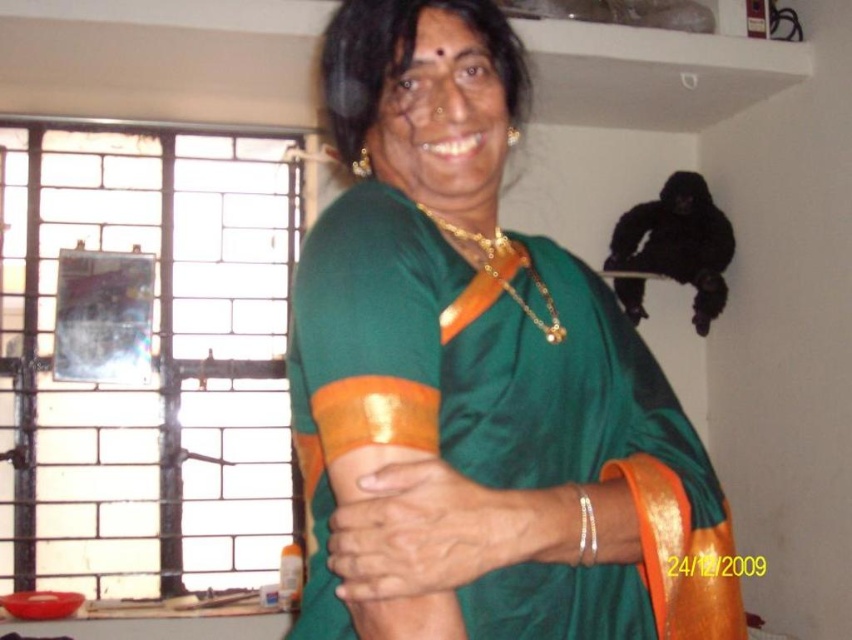
Question: Is green silk hand at center in front of gold chain at upper center?

Choices:
 (A) no
 (B) yes

Answer: (B)

Question: Which of the following is the closest to the observer?

Choices:
 (A) gold chain at upper center
 (B) green silk hand at center

Answer: (B)

Question: Does green silk saree at center come behind gold chain at upper center?

Choices:
 (A) yes
 (B) no

Answer: (B)

Question: Is green silk hand at center below gold chain at upper center?

Choices:
 (A) yes
 (B) no

Answer: (A)

Question: Which object is positioned farthest from the gold chain at upper center?

Choices:
 (A) green silk hand at center
 (B) green silk saree at center

Answer: (A)

Question: Among these objects, which one is nearest to the camera?

Choices:
 (A) green silk hand at center
 (B) green silk saree at center

Answer: (A)